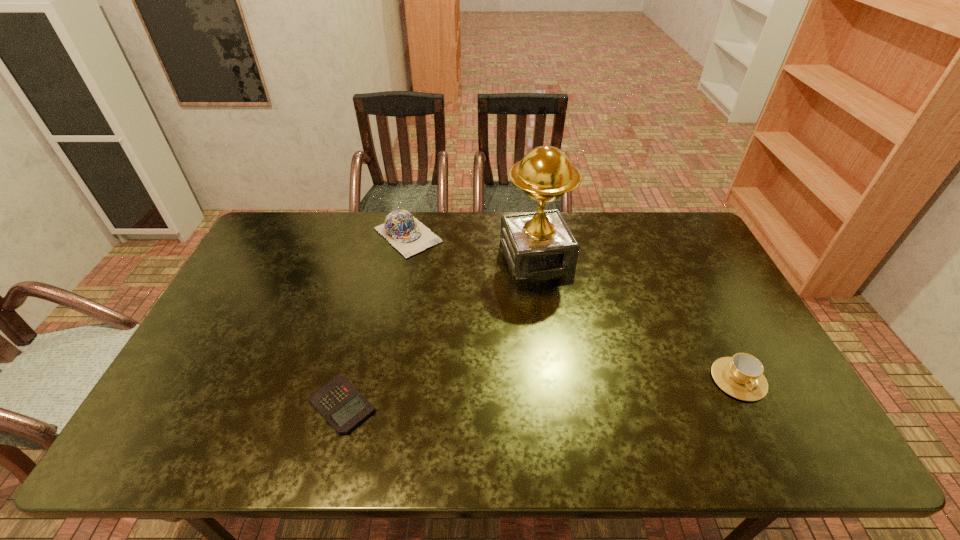
In order to click on free area in between the calculator and the third shortest object in this screenshot , I will do `click(375, 320)`.

Image resolution: width=960 pixels, height=540 pixels. What are the coordinates of `free point between the cap and the shortest object` in the screenshot? It's located at (375, 320).

Image resolution: width=960 pixels, height=540 pixels. Find the location of `vacant area that lies between the cup and the award`. vacant area that lies between the cup and the award is located at coordinates (637, 318).

What are the coordinates of `free space between the shortest object and the second shortest object` in the screenshot? It's located at (540, 392).

Identify the location of the third closest object to the third object from left to right. (339, 402).

This screenshot has width=960, height=540. In order to click on object that stands as the third closest to the third shortest object in this screenshot , I will do `click(741, 376)`.

What are the coordinates of `vacant space that satisfies the following two spatial constraints: 1. on the front side of the third shortest object; 2. on the right side of the tallest object` in the screenshot? It's located at (404, 255).

What are the coordinates of `vacant space that satisfies the following two spatial constraints: 1. on the back side of the calculator; 2. on the right side of the award` in the screenshot? It's located at (380, 255).